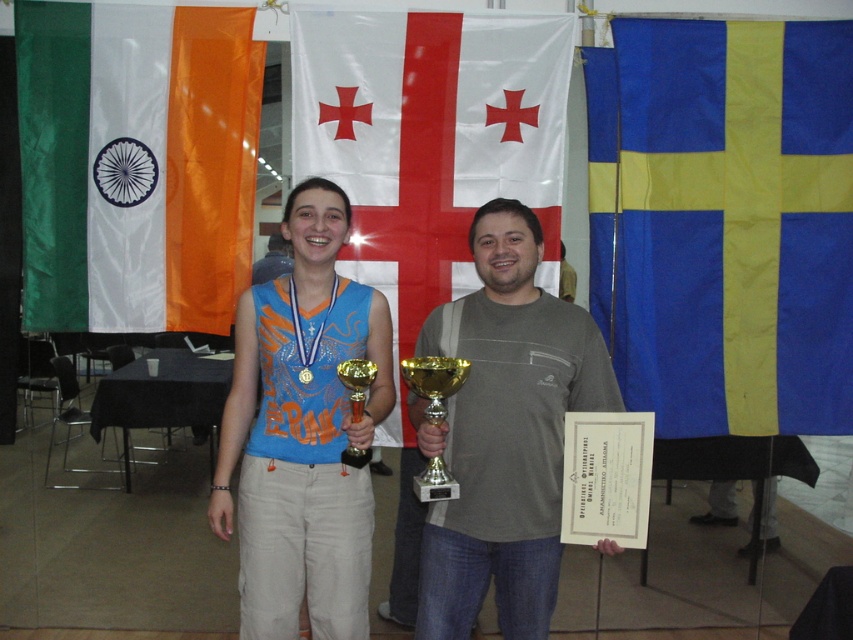
Can you confirm if blue/yellow fabric flag at right is wider than gold metallic trophy at center?

Correct, the width of blue/yellow fabric flag at right exceeds that of gold metallic trophy at center.

Looking at this image, does blue/yellow fabric flag at right have a smaller size compared to gold metallic trophy at center?

No, blue/yellow fabric flag at right is not smaller than gold metallic trophy at center.

Locate an element on the screen. The image size is (853, 640). blue/yellow fabric flag at right is located at coordinates (729, 221).

Is blue/yellow fabric flag at right positioned before gray matte t-shirt at center?

No.

Does blue/yellow fabric flag at right appear over gray matte t-shirt at center?

Yes, blue/yellow fabric flag at right is above gray matte t-shirt at center.

Identify the location of blue/yellow fabric flag at right. (729, 221).

Locate an element on the screen. blue/yellow fabric flag at right is located at coordinates (729, 221).

Who is lower down, whiteflag at center or gray matte t-shirt at center?

gray matte t-shirt at center is below.

Is whiteflag at center smaller than gray matte t-shirt at center?

Yes.

Identify the location of whiteflag at center. (428, 145).

Where is `whiteflag at center`? whiteflag at center is located at coordinates (428, 145).